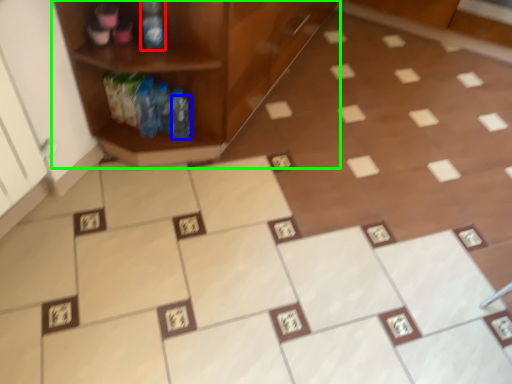
Question: Which object is the farthest from bottle (highlighted by a red box)? Choose among these: bottle (highlighted by a blue box) or shelf (highlighted by a green box).

Choices:
 (A) bottle
 (B) shelf

Answer: (A)